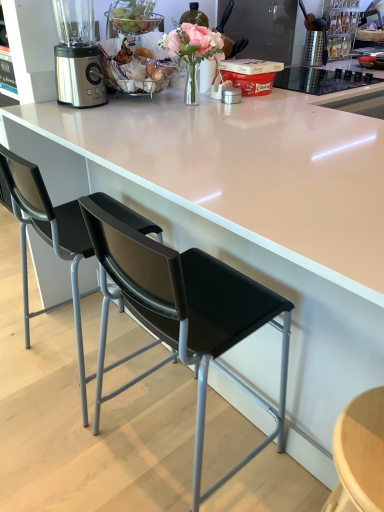
Question: Considering the relative sizes of black plastic chair at left, arranged as the 2th chair when viewed from the right, and black leather chair at center, which is counted as the 2th chair, starting from the left, in the image provided, is black plastic chair at left, arranged as the 2th chair when viewed from the right, wider than black leather chair at center, which is counted as the 2th chair, starting from the left,?

Choices:
 (A) yes
 (B) no

Answer: (A)

Question: Is black plastic chair at left, acting as the first chair starting from the left, beside black leather chair at center, the 1th chair from the right?

Choices:
 (A) no
 (B) yes

Answer: (A)

Question: Can black leather chair at center, the 1th chair from the right, be found inside black plastic chair at left, arranged as the 2th chair when viewed from the right?

Choices:
 (A) no
 (B) yes

Answer: (A)

Question: Could you tell me if black plastic chair at left, arranged as the 2th chair when viewed from the right, is turned towards black leather chair at center, which is counted as the 2th chair, starting from the left?

Choices:
 (A) no
 (B) yes

Answer: (A)

Question: Is black plastic chair at left, arranged as the 2th chair when viewed from the right, positioned behind black leather chair at center, the 1th chair from the right?

Choices:
 (A) no
 (B) yes

Answer: (B)

Question: Based on their sizes in the image, would you say satin silver blender at upper left is bigger or smaller than black plastic chair at left, arranged as the 2th chair when viewed from the right?

Choices:
 (A) big
 (B) small

Answer: (B)

Question: Considering the positions of satin silver blender at upper left and black plastic chair at left, acting as the first chair starting from the left, in the image, is satin silver blender at upper left wider or thinner than black plastic chair at left, acting as the first chair starting from the left,?

Choices:
 (A) thin
 (B) wide

Answer: (A)

Question: Would you say satin silver blender at upper left is to the left or to the right of black plastic chair at left, arranged as the 2th chair when viewed from the right, in the picture?

Choices:
 (A) right
 (B) left

Answer: (B)

Question: From the image's perspective, is satin silver blender at upper left positioned above or below black plastic chair at left, acting as the first chair starting from the left?

Choices:
 (A) below
 (B) above

Answer: (B)

Question: Looking at their shapes, would you say black plastic chair at left, arranged as the 2th chair when viewed from the right, is wider or thinner than black leather chair at center, the 1th chair from the right?

Choices:
 (A) thin
 (B) wide

Answer: (B)

Question: Is black plastic chair at left, acting as the first chair starting from the left, in front of or behind black leather chair at center, the 1th chair from the right, in the image?

Choices:
 (A) behind
 (B) front

Answer: (A)

Question: From the image's perspective, relative to black leather chair at center, which is counted as the 2th chair, starting from the left, is black plastic chair at left, acting as the first chair starting from the left, above or below?

Choices:
 (A) above
 (B) below

Answer: (A)

Question: Is black plastic chair at left, arranged as the 2th chair when viewed from the right, bigger or smaller than black leather chair at center, the 1th chair from the right?

Choices:
 (A) small
 (B) big

Answer: (B)

Question: From a real-world perspective, is black plastic chair at left, acting as the first chair starting from the left, positioned above or below satin silver blender at upper left?

Choices:
 (A) below
 (B) above

Answer: (A)

Question: Is black plastic chair at left, acting as the first chair starting from the left, bigger or smaller than satin silver blender at upper left?

Choices:
 (A) small
 (B) big

Answer: (B)